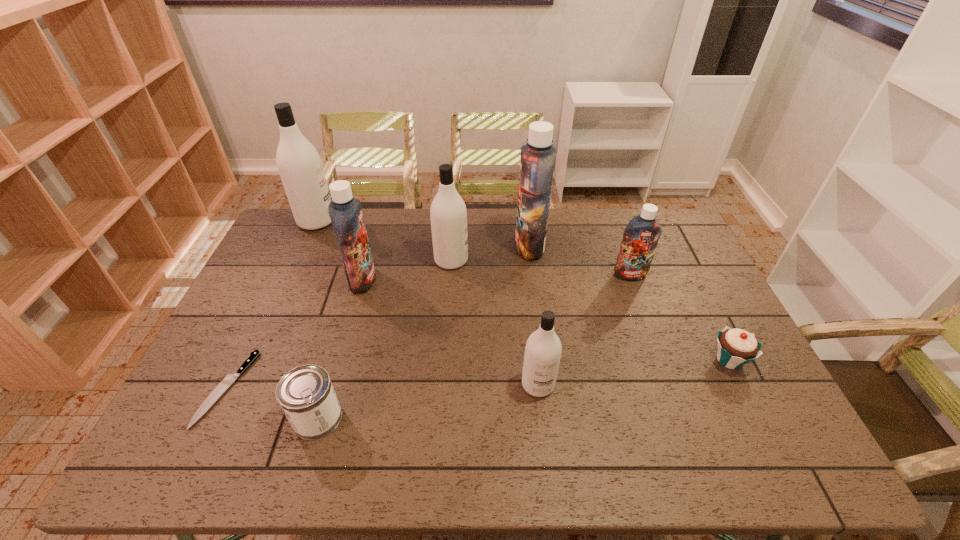
Image resolution: width=960 pixels, height=540 pixels. I want to click on object located in the right edge section of the desktop, so click(x=736, y=347).

Where is `object that is positioned at the far left corner`? object that is positioned at the far left corner is located at coordinates (299, 164).

This screenshot has width=960, height=540. In the image, there is a desktop. In order to click on blank space at the far edge in this screenshot , I will do `click(510, 209)`.

At what (x,y) coordinates should I click in order to perform the action: click on vacant space at the near edge. Please return your answer as a coordinate pair (x, y). The image size is (960, 540). Looking at the image, I should click on (570, 448).

Where is `free space at the left edge of the desktop`? free space at the left edge of the desktop is located at coordinates tap(261, 300).

The image size is (960, 540). Identify the location of free space at the right edge. (665, 262).

Find the location of a particular element. The image size is (960, 540). vacant region at the far left corner of the desktop is located at coordinates (308, 235).

Image resolution: width=960 pixels, height=540 pixels. Identify the location of vacant space at the near left corner of the desktop. (212, 457).

You are a GUI agent. You are given a task and a screenshot of the screen. Output one action in this format:
    pyautogui.click(x=<x>, y=<y>)
    Task: Click on the free spot between the second biggest blue shampoo and the shortest object
    Image resolution: width=960 pixels, height=540 pixels.
    Given the screenshot: What is the action you would take?
    pyautogui.click(x=295, y=334)

Locate an element on the screen. The width and height of the screenshot is (960, 540). free space between the second blue shampoo from left to right and the farthest white shampoo is located at coordinates (423, 233).